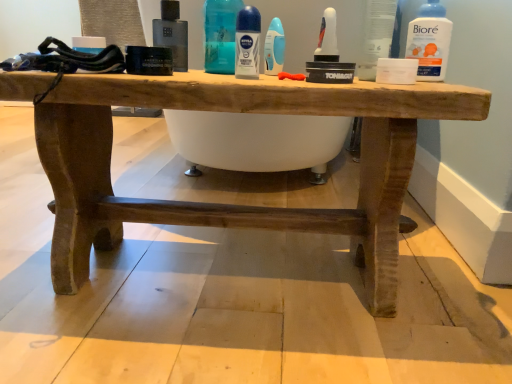
Question: From a real-world perspective, relative to blue glossy deodorant stick at center, positioned as the first cleaning product in right-to-left order, is blue plastic deodorant at center, placed as the 2th cleaning product when sorted from right to left, vertically above or below?

Choices:
 (A) above
 (B) below

Answer: (A)

Question: From their relative heights in the image, would you say blue plastic deodorant at center, placed as the 2th cleaning product when sorted from right to left, is taller or shorter than blue glossy deodorant stick at center, the 2th cleaning product viewed from the left?

Choices:
 (A) short
 (B) tall

Answer: (B)

Question: Estimate the real-world distances between objects in this image. Which object is farther from the blue glossy deodorant stick at center, which is counted as the second mouthwash, starting from the right?

Choices:
 (A) blue glossy deodorant stick at center, the 2th cleaning product viewed from the left
 (B) white plastic bottle at upper right, which is the 1th mouthwash in right-to-left order
 (C) blue plastic deodorant at center, placed as the 2th cleaning product when sorted from right to left
 (D) transparent plastic container at upper right
 (E) rustic wood table at center

Answer: (B)

Question: Which is farther from the transparent plastic container at upper right?

Choices:
 (A) white plastic bottle at upper right, the third mouthwash when ordered from left to right
 (B) blue plastic deodorant at center, placed as the 2th cleaning product when sorted from right to left
 (C) matte black bottle at center, placed as the 1th mouthwash when sorted from left to right
 (D) blue glossy deodorant stick at center, the 2th cleaning product viewed from the left
 (E) rustic wood table at center

Answer: (C)